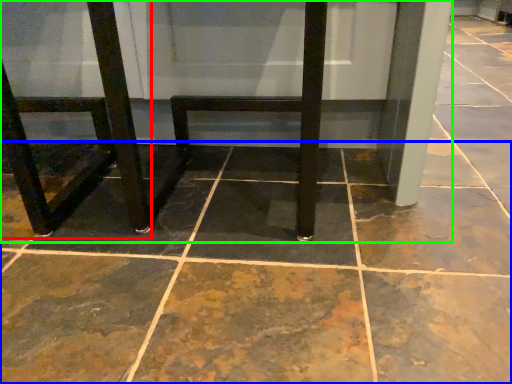
Question: Based on their relative distances, which object is nearer to chair (highlighted by a red box)? Choose from concrete (highlighted by a blue box) and furniture (highlighted by a green box).

Choices:
 (A) concrete
 (B) furniture

Answer: (B)